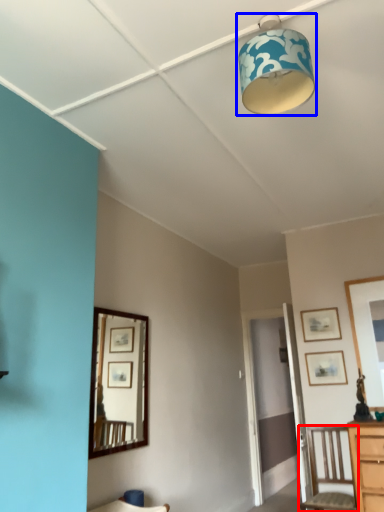
Question: Which point is further to the camera, chair (highlighted by a red box) or lamp (highlighted by a blue box)?

Choices:
 (A) chair
 (B) lamp

Answer: (A)